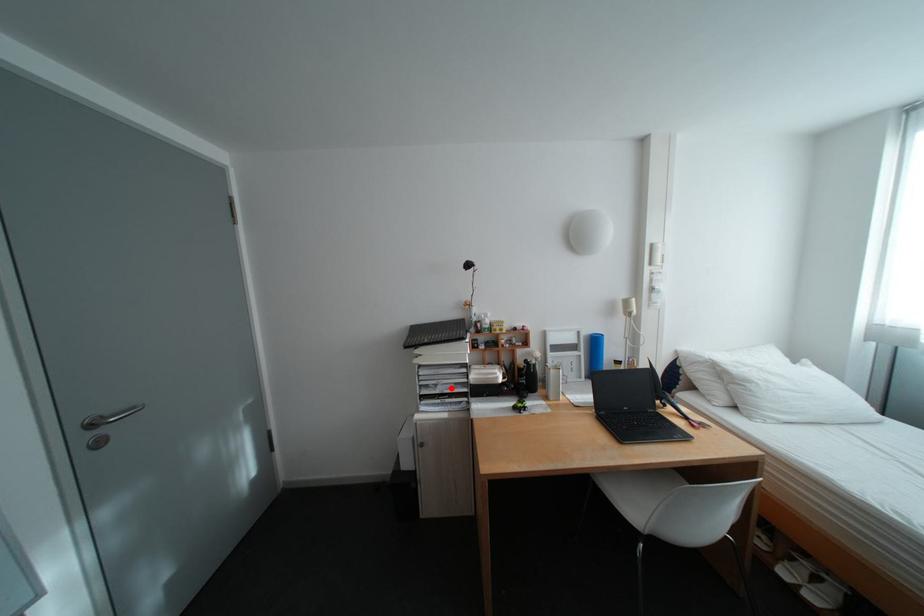
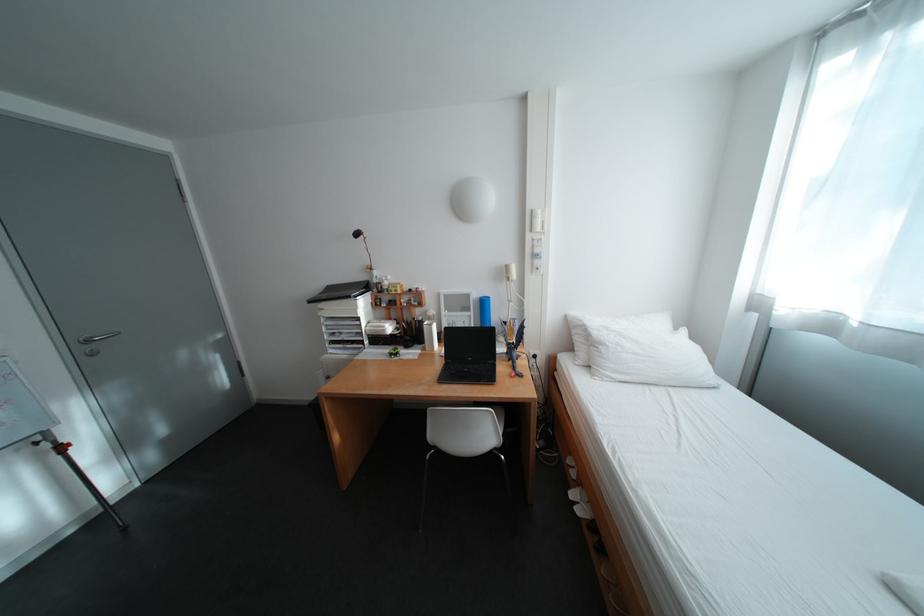
Locate, in the second image, the point that corresponds to the highlighted location in the first image.

(355, 336)